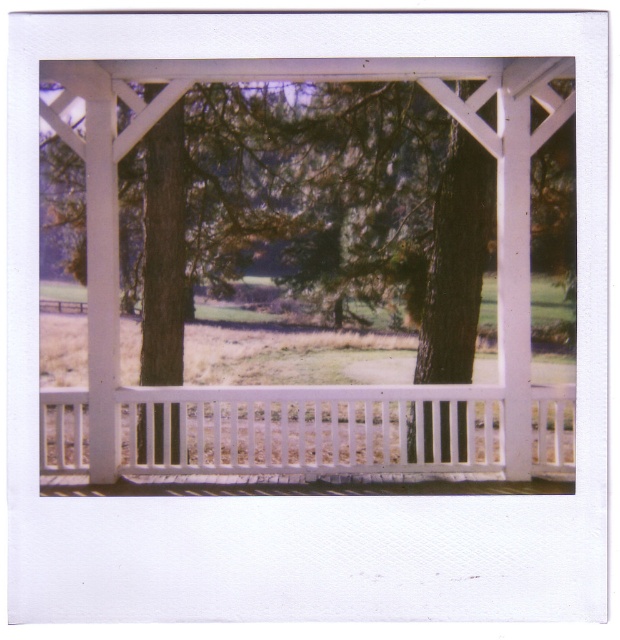
Question: Can you confirm if white painted wood pergola at center is smaller than white wooden railing at center?

Choices:
 (A) no
 (B) yes

Answer: (A)

Question: Among these points, which one is nearest to the camera?

Choices:
 (A) 476,422
 (B) 81,436

Answer: (A)

Question: Can you confirm if white painted wood pergola at center is thinner than white wooden railing at center?

Choices:
 (A) no
 (B) yes

Answer: (B)

Question: Can you confirm if white painted wood pergola at center is positioned above white wooden railing at center?

Choices:
 (A) yes
 (B) no

Answer: (A)

Question: Which point is closer to the camera?

Choices:
 (A) (105, 161)
 (B) (45, 417)

Answer: (A)